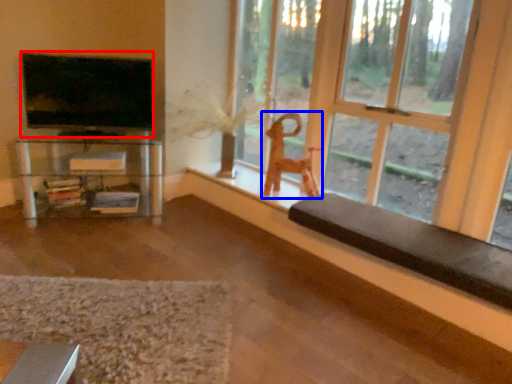
Question: Which point is further to the camera, television (highlighted by a red box) or toy (highlighted by a blue box)?

Choices:
 (A) television
 (B) toy

Answer: (B)